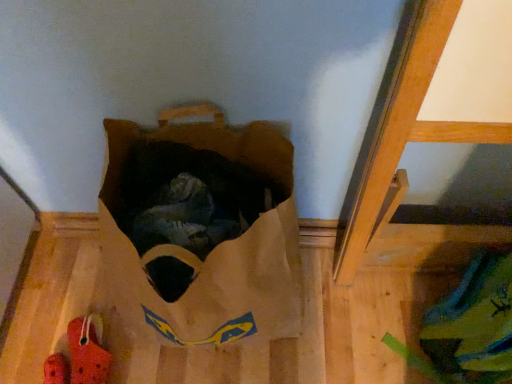
Question: Should I look upward or downward to see brown paper bag at upper center?

Choices:
 (A) up
 (B) down

Answer: (B)

Question: Does rubber/crocodile at lower left have a lesser width compared to brown paper bag at upper center?

Choices:
 (A) yes
 (B) no

Answer: (A)

Question: Is rubber/crocodile at lower left shorter than brown paper bag at upper center?

Choices:
 (A) no
 (B) yes

Answer: (B)

Question: Does rubber/crocodile at lower left touch brown paper bag at upper center?

Choices:
 (A) yes
 (B) no

Answer: (B)

Question: Considering the relative sizes of rubber/crocodile at lower left and brown paper bag at upper center in the image provided, is rubber/crocodile at lower left bigger than brown paper bag at upper center?

Choices:
 (A) yes
 (B) no

Answer: (B)

Question: Does rubber/crocodile at lower left have a greater width compared to brown paper bag at upper center?

Choices:
 (A) no
 (B) yes

Answer: (A)

Question: Is rubber/crocodile at lower left at the left side of brown paper bag at upper center?

Choices:
 (A) yes
 (B) no

Answer: (A)

Question: Is brown paper bag at upper center thinner than rubber/crocodile at lower left?

Choices:
 (A) yes
 (B) no

Answer: (B)

Question: From the image's perspective, is brown paper bag at upper center below rubber/crocodile at lower left?

Choices:
 (A) yes
 (B) no

Answer: (B)

Question: Are brown paper bag at upper center and rubber/crocodile at lower left beside each other?

Choices:
 (A) no
 (B) yes

Answer: (A)

Question: Is brown paper bag at upper center shorter than rubber/crocodile at lower left?

Choices:
 (A) yes
 (B) no

Answer: (B)

Question: Can you confirm if brown paper bag at upper center is bigger than rubber/crocodile at lower left?

Choices:
 (A) no
 (B) yes

Answer: (B)

Question: Could you tell me if brown paper bag at upper center is turned towards rubber/crocodile at lower left?

Choices:
 (A) yes
 (B) no

Answer: (B)

Question: Do you think brown paper bag at upper center is within rubber/crocodile at lower left, or outside of it?

Choices:
 (A) inside
 (B) outside

Answer: (B)